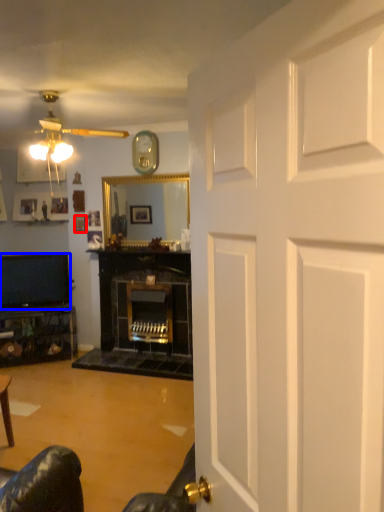
Question: Among these objects, which one is nearest to the camera, picture frame (highlighted by a red box) or television (highlighted by a blue box)?

Choices:
 (A) picture frame
 (B) television

Answer: (B)